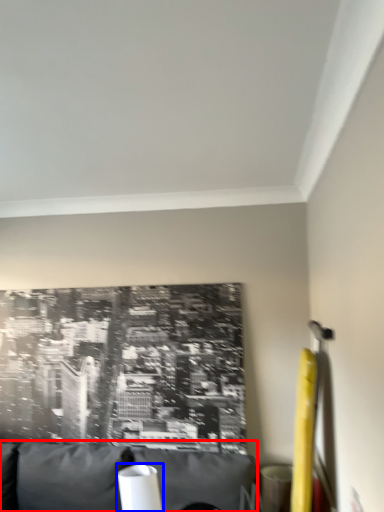
Question: Among these objects, which one is farthest to the camera, furniture (highlighted by a red box) or table lamp (highlighted by a blue box)?

Choices:
 (A) furniture
 (B) table lamp

Answer: (B)